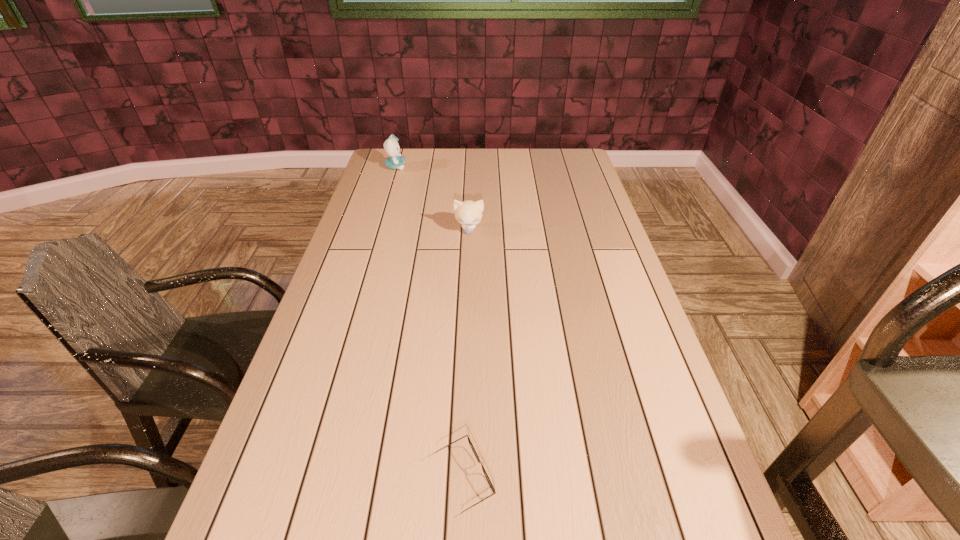
In order to click on vacant point located between the second nearest object and the leftmost object in this screenshot , I will do `click(432, 198)`.

You are a GUI agent. You are given a task and a screenshot of the screen. Output one action in this format:
    pyautogui.click(x=<x>, y=<y>)
    Task: Click on the object that ranks as the closest to the spectacles
    This screenshot has height=540, width=960.
    Given the screenshot: What is the action you would take?
    pyautogui.click(x=468, y=213)

Choose which object is the nearest neighbor to the shortest object. Please provide its 2D coordinates. Your answer should be formatted as a tuple, i.e. [(x, y)], where the tuple contains the x and y coordinates of a point satisfying the conditions above.

[(468, 213)]